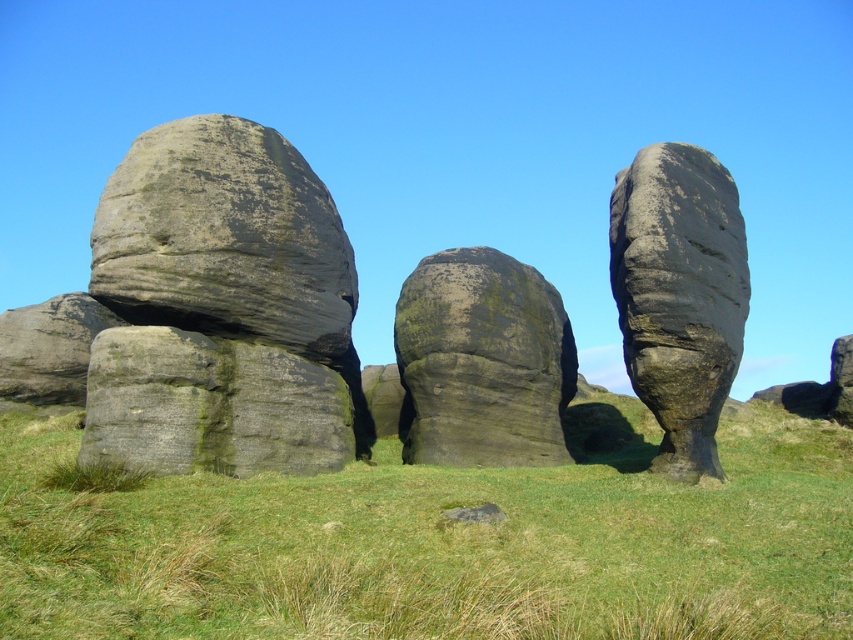
Question: From the image, what is the correct spatial relationship of gray stone boulder at center in relation to green mossy rock at center?

Choices:
 (A) right
 (B) left

Answer: (B)

Question: Which point is farther to the camera?

Choices:
 (A) rough gray rock at center
 (B) green grass at center
 (C) gray stone boulder at center
 (D) green mossy rock at center

Answer: (D)

Question: Does gray stone boulder at center have a lesser width compared to green mossy rock at center?

Choices:
 (A) no
 (B) yes

Answer: (A)

Question: Considering the real-world distances, which object is closest to the green mossy rock at center?

Choices:
 (A) green grass at center
 (B) rough gray rock at center

Answer: (B)

Question: Among these points, which one is nearest to the camera?

Choices:
 (A) (814, 604)
 (B) (158, 156)
 (C) (474, 328)
 (D) (746, 259)

Answer: (A)

Question: Does green grass at center have a lesser width compared to rough gray rock at center?

Choices:
 (A) no
 (B) yes

Answer: (A)